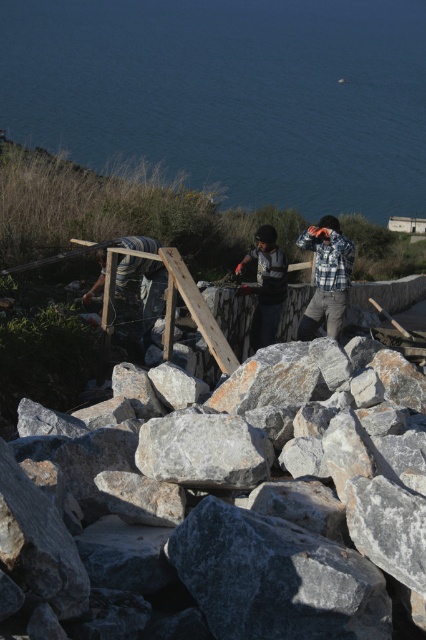
Can you confirm if gray granite rocks at center is wider than dark gray fabric shirt at center?

Yes, gray granite rocks at center is wider than dark gray fabric shirt at center.

Between gray granite rocks at center and dark gray fabric shirt at center, which one is positioned higher?

dark gray fabric shirt at center is higher up.

Does point (258, 444) come farther from viewer compared to point (279, 257)?

That is False.

At what (x,y) coordinates should I click in order to perform the action: click on gray granite rocks at center. Please return your answer as a coordinate pair (x, y). Looking at the image, I should click on (241, 504).

Is blue water at upper center smaller than striped shirt at center?

No.

Can you confirm if blue water at upper center is positioned to the right of striped shirt at center?

Indeed, blue water at upper center is positioned on the right side of striped shirt at center.

This screenshot has height=640, width=426. What do you see at coordinates (230, 93) in the screenshot? I see `blue water at upper center` at bounding box center [230, 93].

What are the coordinates of `blue water at upper center` in the screenshot? It's located at (230, 93).

Between point (175, 513) and point (204, 100), which one is positioned behind?

Positioned behind is point (204, 100).

Is gray granite rocks at center smaller than blue water at upper center?

Correct, gray granite rocks at center occupies less space than blue water at upper center.

In the scene shown: Who is more distant from viewer, (x=183, y=472) or (x=336, y=68)?

Point (x=336, y=68)

Find the location of a particular element. The image size is (426, 640). gray granite rocks at center is located at coordinates point(241,504).